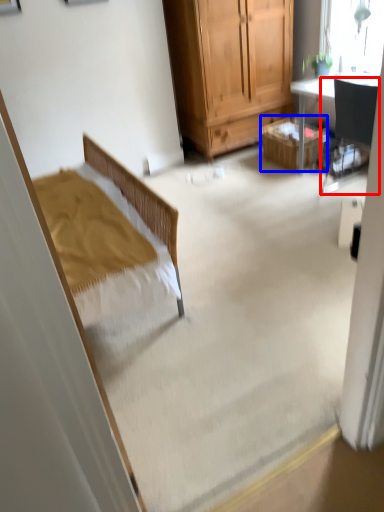
Question: Which of the following is the farthest to the observer, chair (highlighted by a red box) or picnic basket (highlighted by a blue box)?

Choices:
 (A) chair
 (B) picnic basket

Answer: (B)